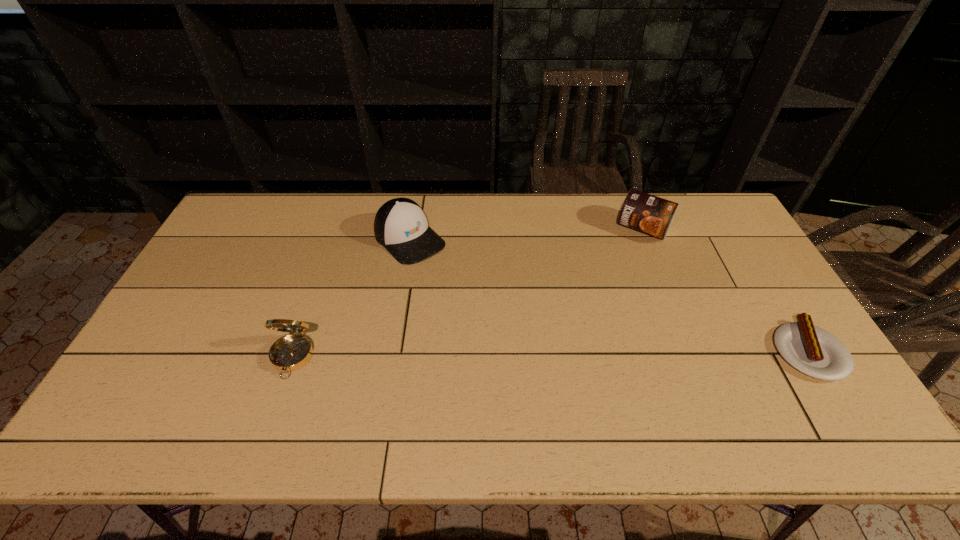
Locate an element on the screen. vacant space at the left edge of the desktop is located at coordinates (245, 280).

This screenshot has width=960, height=540. In the image, there is a desktop. What are the coordinates of `vacant space at the right edge` in the screenshot? It's located at (752, 289).

In the image, there is a desktop. Where is `vacant space at the far right corner`? The height and width of the screenshot is (540, 960). vacant space at the far right corner is located at coordinates (711, 215).

The width and height of the screenshot is (960, 540). In order to click on free location at the near right corner of the desktop in this screenshot , I will do `click(802, 383)`.

Find the location of a particular element. vacant area that lies between the cap and the second object from right to left is located at coordinates (526, 234).

Find the location of a particular element. unoccupied position between the sausage and the cap is located at coordinates (609, 295).

At what (x,y) coordinates should I click in order to perform the action: click on blank region between the third object from left to right and the cap. Please return your answer as a coordinate pair (x, y). The width and height of the screenshot is (960, 540). Looking at the image, I should click on (526, 234).

Locate an element on the screen. This screenshot has height=540, width=960. vacant area between the second object from left to right and the second object from right to left is located at coordinates (526, 234).

Where is `free space between the can and the second object from left to right`? The image size is (960, 540). free space between the can and the second object from left to right is located at coordinates (526, 234).

Locate an element on the screen. The height and width of the screenshot is (540, 960). blank region between the shortest object and the compass is located at coordinates (550, 354).